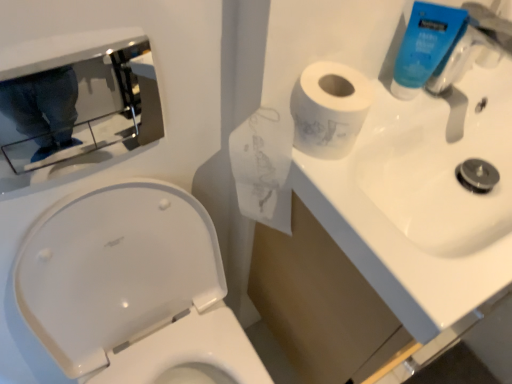
Locate an element on the screen. free spot in front of blue plastic tube at upper right is located at coordinates (377, 145).